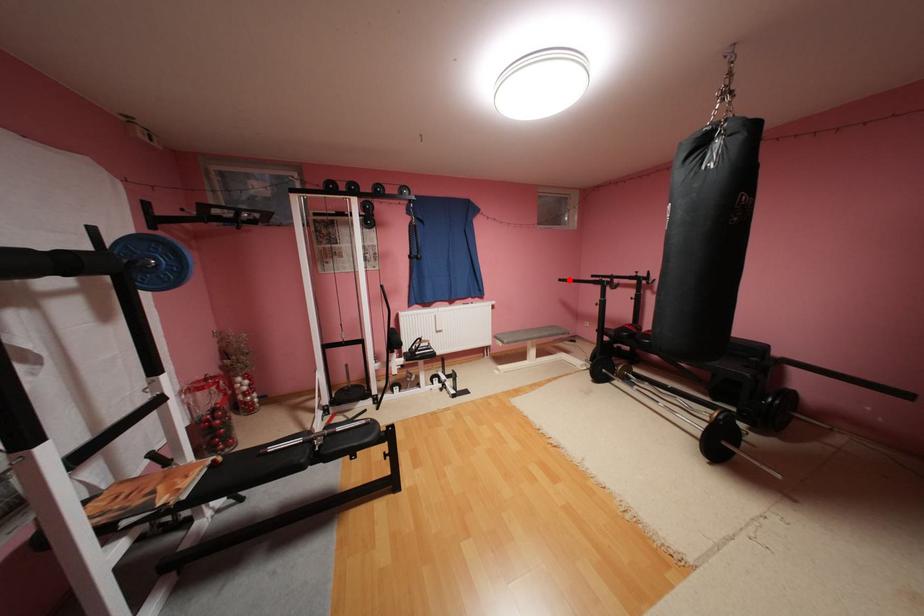
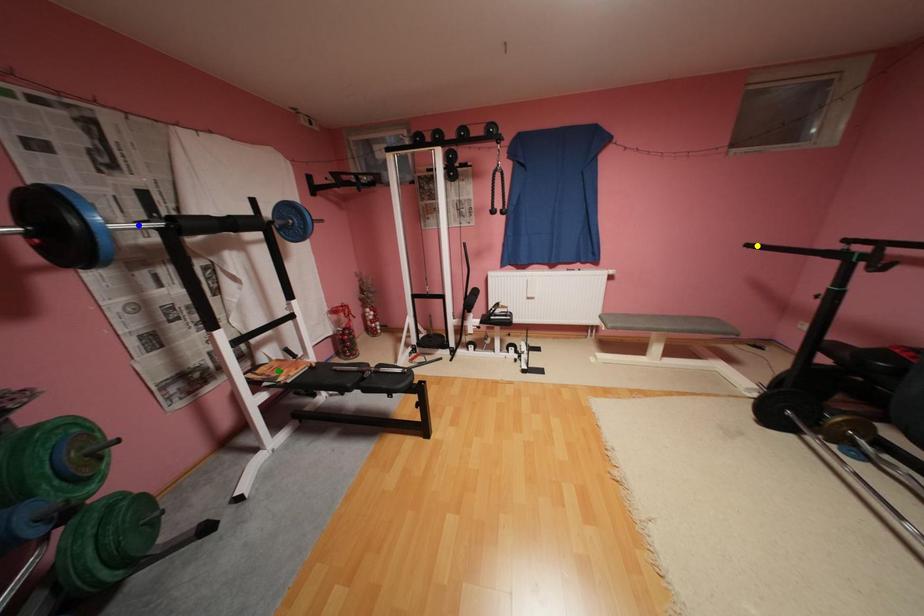
Question: I am providing you with two images of the same scene from different viewpoints. A red point is marked on the first image. You are given multiple points on the second image. Which spot in image 2 lines up with the point in image 1?

Choices:
 (A) blue point
 (B) yellow point
 (C) green point

Answer: (B)